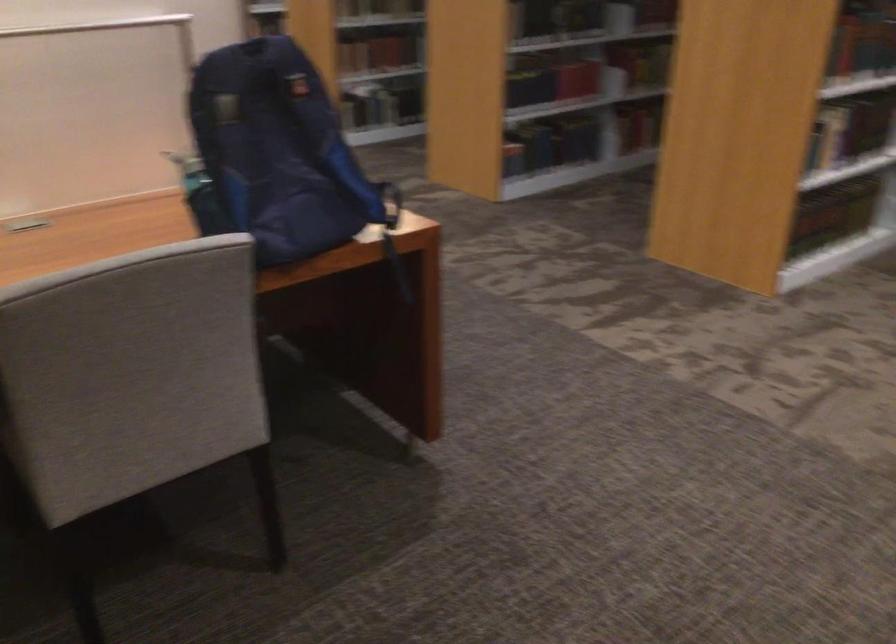
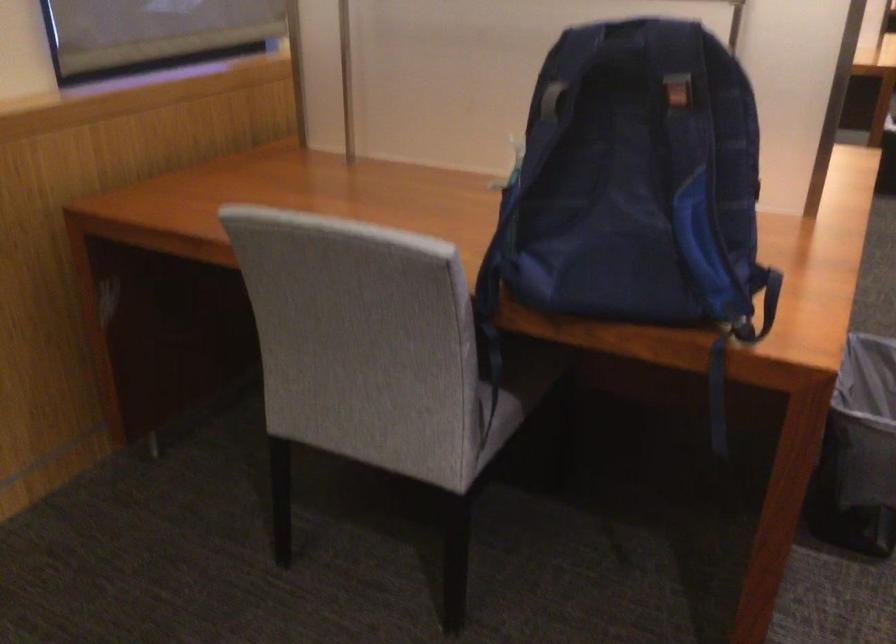
In the second image, find the point that corresponds to [400,270] in the first image.

(718, 395)